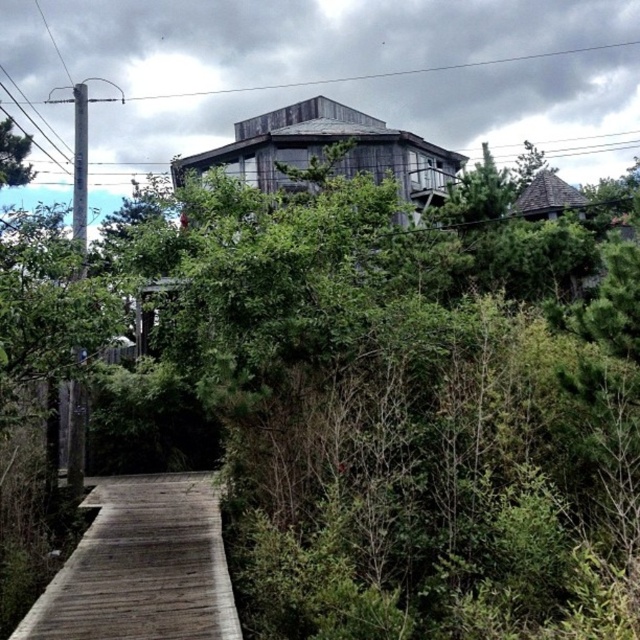
You are planning to build a new wooden structure and want to ensure it fits within the available space. You observe the wooden hut at center and the brown shingled hut at upper right in the image. Which of these huts is wider according to the scene?

The wooden hut at center is wider than the brown shingled hut at upper right according to the scene description.

You are standing at the origin point of the image. A wooden hut at center is located at point (x=323, y=148). Can you walk directly to the wooden hut at center from your current position without crossing any obstacles?

The wooden hut at center is located at point (x=323, y=148). Since the image shows a narrow wooden walkway extending towards the structure and the foreground has lush vegetation bordering the walkway, you can walk directly to the wooden hut at center along the walkway without crossing obstacles other than the walkway itself.

You are standing on the wooden planks at lower left and want to reach the wooden hut at center. Which direction should you move to get there?

To reach the wooden hut at center from the wooden planks at lower left, you should move to the right since the wooden planks at lower left is positioned on the left side of the wooden hut at center.